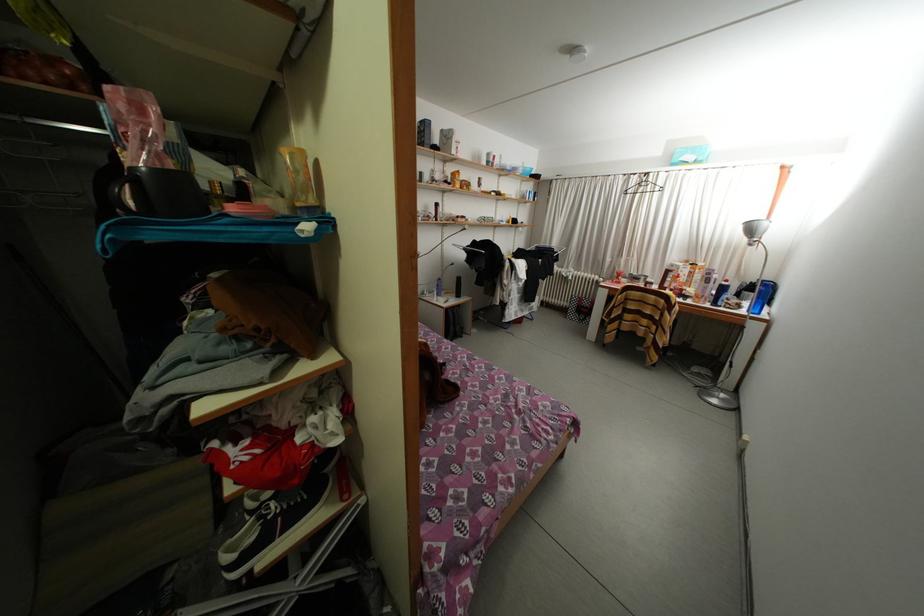
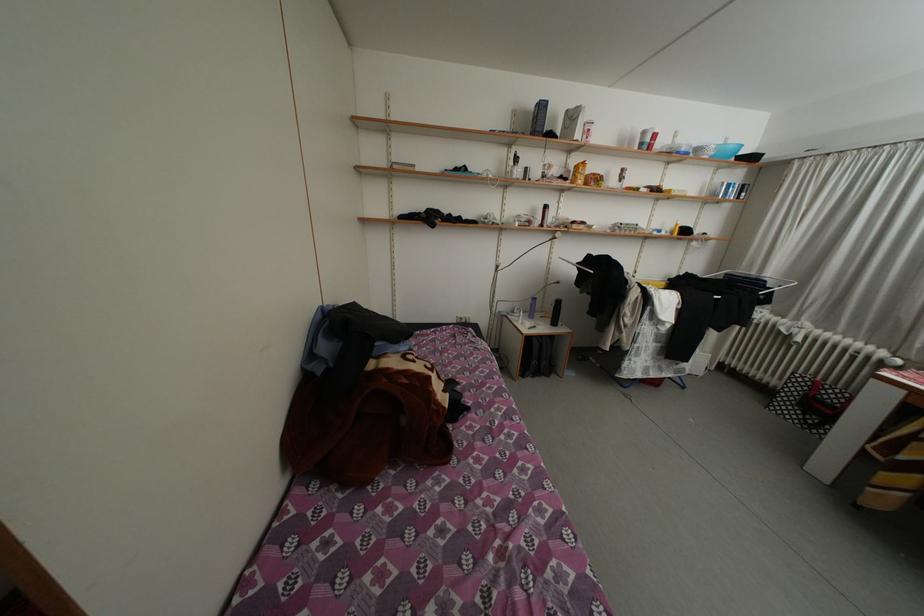
The point at (455, 140) is marked in the first image. Where is the corresponding point in the second image?

(580, 122)